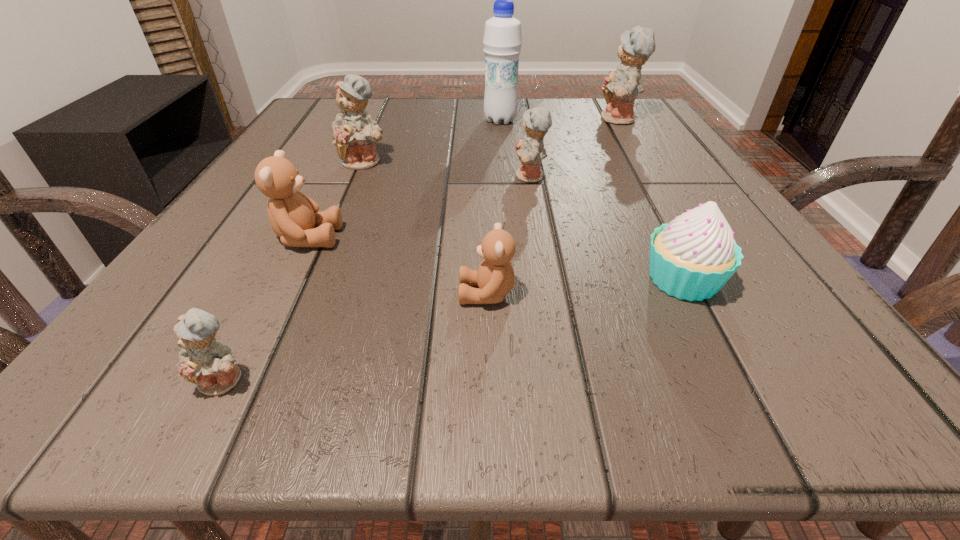
This screenshot has height=540, width=960. I want to click on object present at the near edge, so click(x=208, y=364).

The image size is (960, 540). Identify the location of teddy bear that is at the right edge. (620, 88).

Where is `cupcake located in the right edge section of the desktop`? cupcake located in the right edge section of the desktop is located at coordinates (692, 257).

In order to click on object located in the near left corner section of the desktop in this screenshot , I will do `click(208, 364)`.

This screenshot has width=960, height=540. Find the location of `object located in the far right corner section of the desktop`. object located in the far right corner section of the desktop is located at coordinates (620, 88).

Image resolution: width=960 pixels, height=540 pixels. In the image, there is a desktop. Find the location of `vacant space at the far edge`. vacant space at the far edge is located at coordinates (452, 114).

You are a GUI agent. You are given a task and a screenshot of the screen. Output one action in this format:
    pyautogui.click(x=<x>, y=<y>)
    Task: Click on the free region at the near edge of the desktop
    Image resolution: width=960 pixels, height=540 pixels.
    Given the screenshot: What is the action you would take?
    pyautogui.click(x=283, y=393)

In the image, there is a desktop. Identify the location of free region at the left edge. (339, 164).

Where is `vacant space at the right edge`? This screenshot has width=960, height=540. vacant space at the right edge is located at coordinates (706, 308).

Locate an element on the screen. Image resolution: width=960 pixels, height=540 pixels. free space at the far left corner of the desktop is located at coordinates (325, 117).